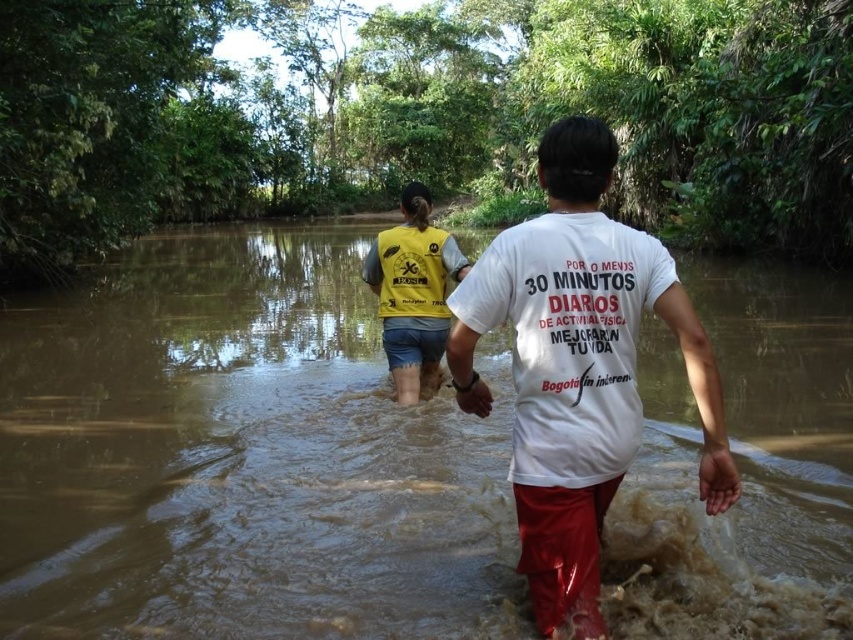
Question: Which object is farther from the camera taking this photo?

Choices:
 (A) white matte t-shirt at center
 (B) yellow fabric vest at center
 (C) brown muddy water at center

Answer: (B)

Question: Among these points, which one is farthest from the camera?

Choices:
 (A) (593, 275)
 (B) (416, 211)

Answer: (B)

Question: Does brown muddy water at center appear on the right side of yellow fabric vest at center?

Choices:
 (A) yes
 (B) no

Answer: (B)

Question: Does brown muddy water at center appear over white matte t-shirt at center?

Choices:
 (A) yes
 (B) no

Answer: (A)

Question: Can you confirm if brown muddy water at center is bigger than white matte t-shirt at center?

Choices:
 (A) no
 (B) yes

Answer: (B)

Question: Which point is farther to the camera?

Choices:
 (A) white matte t-shirt at center
 (B) brown muddy water at center
 (C) yellow fabric vest at center

Answer: (C)